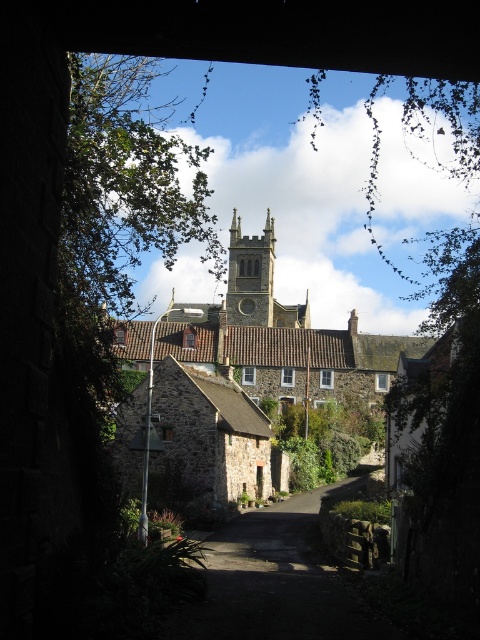
Question: Which object appears farthest from the camera in this image?

Choices:
 (A) brown tiled roof church at center
 (B) smooth stone tower at center

Answer: (B)

Question: Which point is farther to the camera?

Choices:
 (A) smooth stone tower at center
 (B) brown tiled roof church at center

Answer: (A)

Question: Does brown tiled roof church at center have a greater width compared to smooth stone tower at center?

Choices:
 (A) no
 (B) yes

Answer: (B)

Question: Does brown tiled roof church at center appear over smooth stone tower at center?

Choices:
 (A) no
 (B) yes

Answer: (A)

Question: Can you confirm if brown tiled roof church at center is positioned to the right of smooth stone tower at center?

Choices:
 (A) no
 (B) yes

Answer: (B)